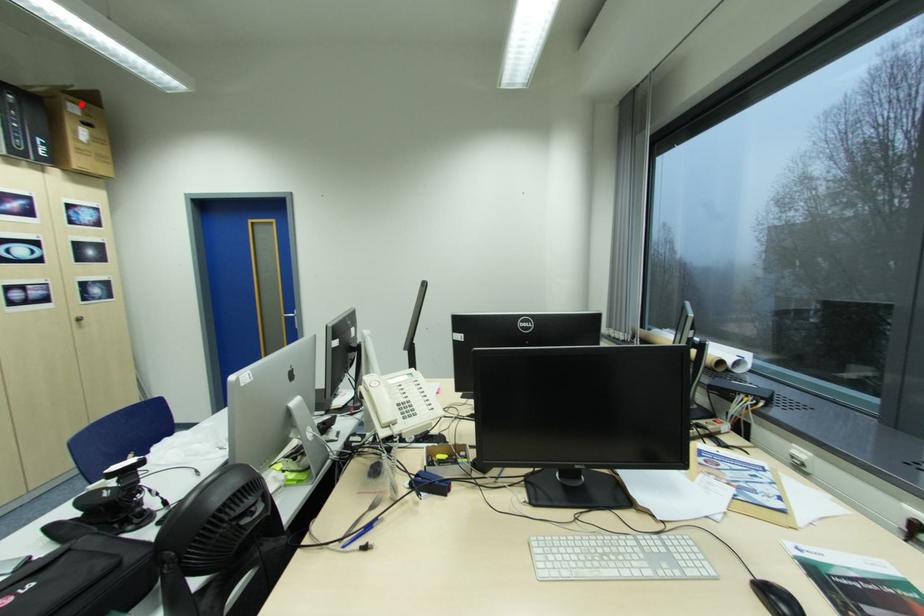
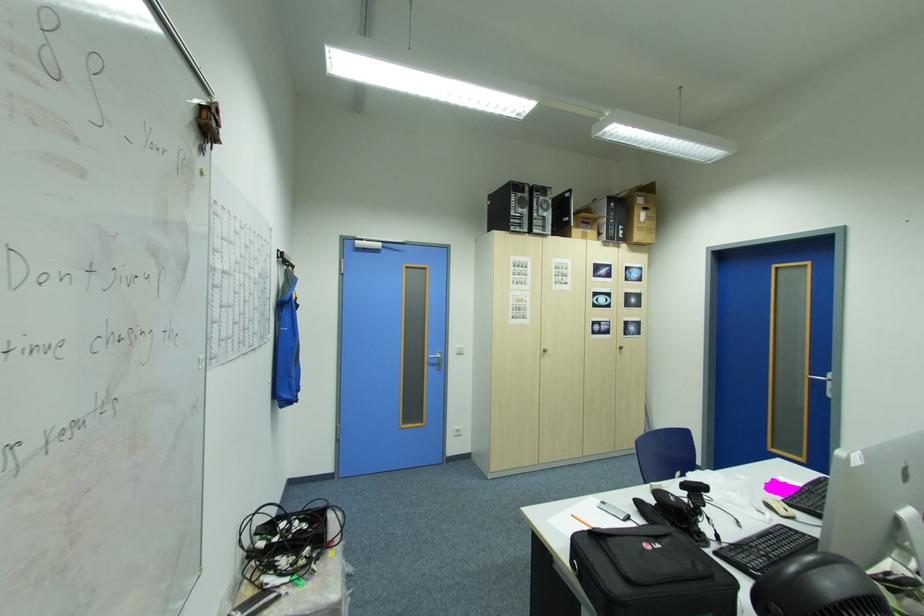
Locate, in the second image, the point that corresponds to the highlighted location in the first image.

(648, 198)